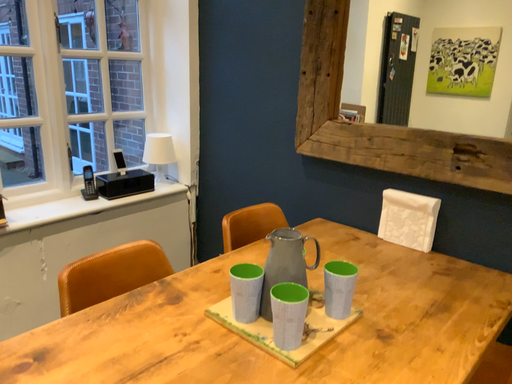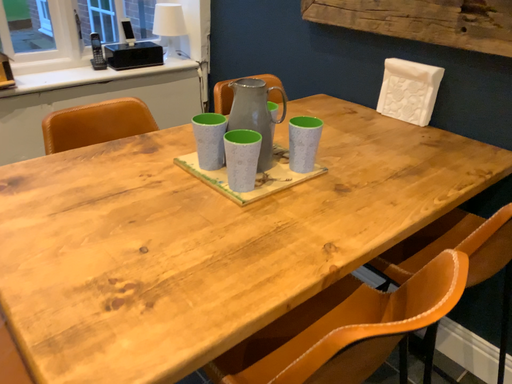
Question: How did the camera likely rotate when shooting the video?

Choices:
 (A) rotated left
 (B) rotated right

Answer: (A)